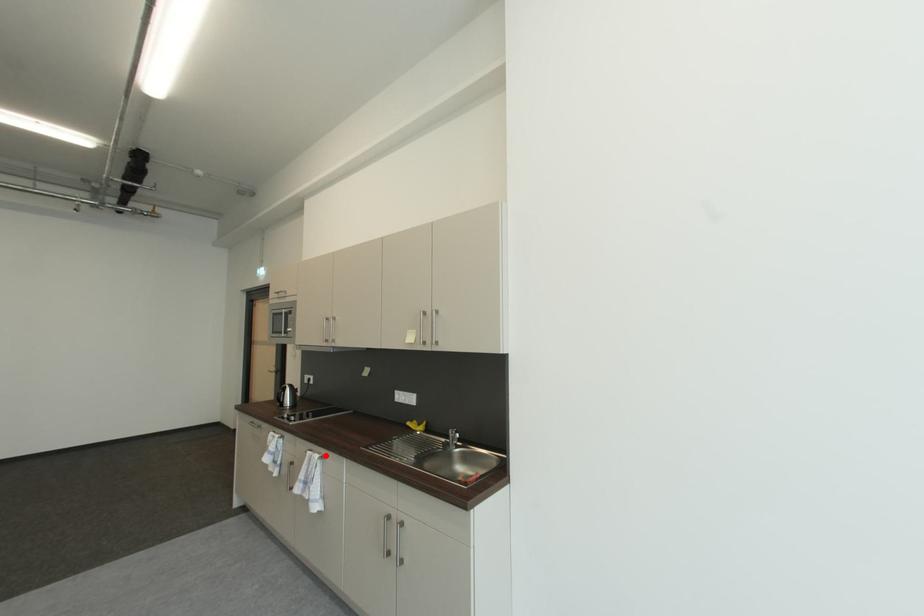
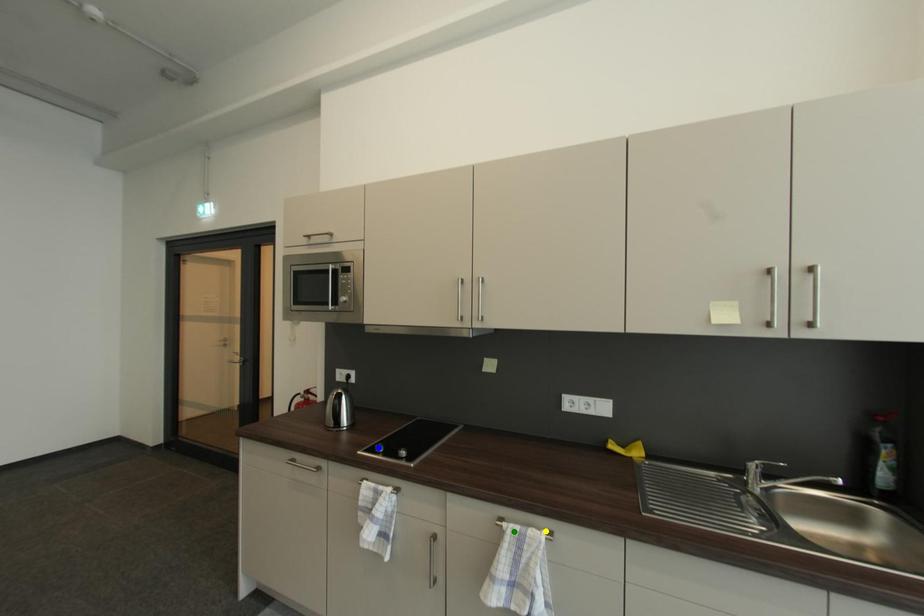
Question: I am providing you with two images of the same scene from different viewpoints. A red point is marked on the first image. You are given multiple points on the second image. Can you choose the point in image 2 that corresponds to the point in image 1?

Choices:
 (A) yellow point
 (B) blue point
 (C) green point

Answer: (A)